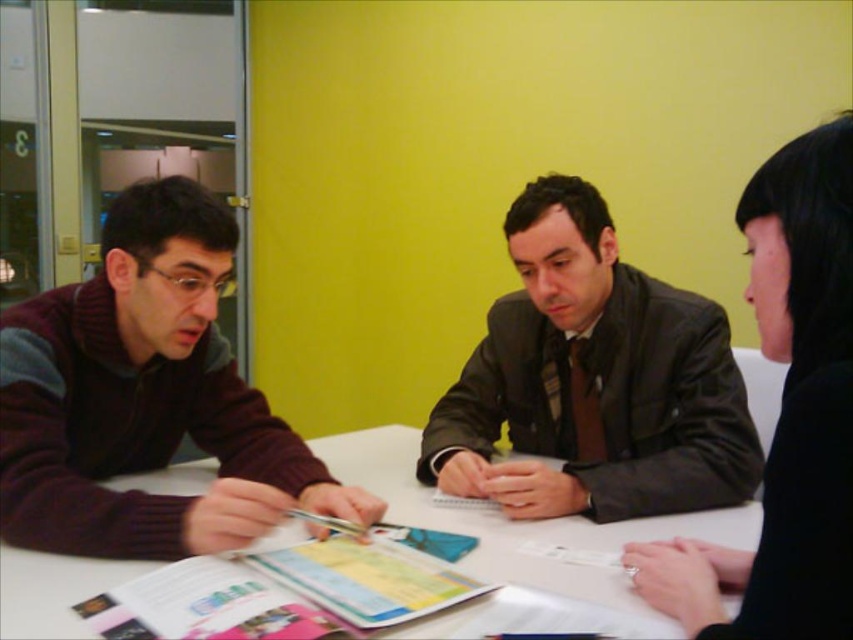
You are organizing a photo shoot and need to place a small decorative item between the dark brown leather jacket at center and the black matte hair at upper right. Considering their sizes, which object should the item be closer to?

The dark brown leather jacket at center is larger than the black matte hair at upper right, so the item should be placed closer to the black matte hair at upper right to balance their sizes.

You are standing in the room and want to hand a note to the person wearing the dark brown leather jacket at center. If you look at the black matte hair at upper right, in which direction should you move relative to that hair to reach the jacket?

The dark brown leather jacket at center is to the left of the black matte hair at upper right, so you should move to the left relative to the black matte hair at upper right to reach the jacket.